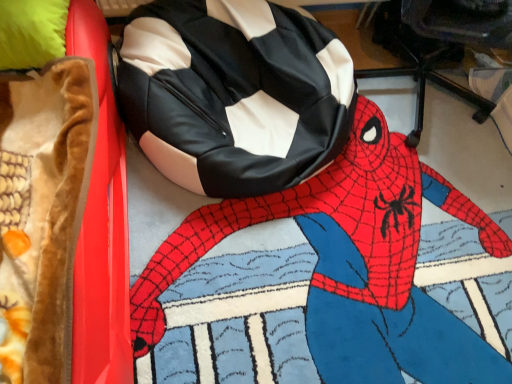
The image size is (512, 384). In order to click on vacant area situated below black leather bean bag at upper center (from a real-world perspective) in this screenshot , I will do `click(357, 266)`.